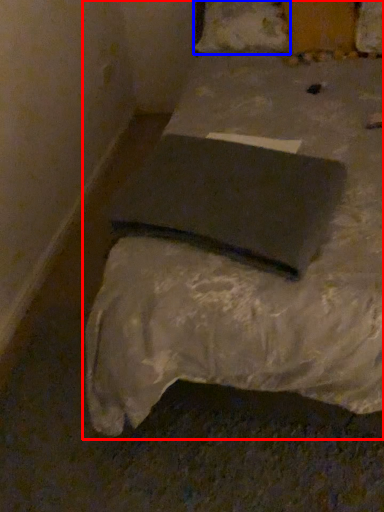
Question: Which of the following is the closest to the observer, bed (highlighted by a red box) or pillow (highlighted by a blue box)?

Choices:
 (A) bed
 (B) pillow

Answer: (A)